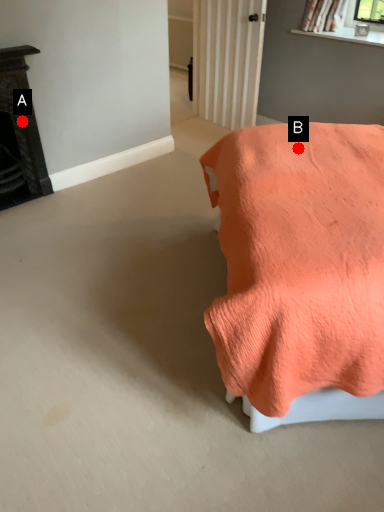
Question: Two points are circled on the image, labeled by A and B beside each circle. Which point is closer to the camera?

Choices:
 (A) A is closer
 (B) B is closer

Answer: (B)